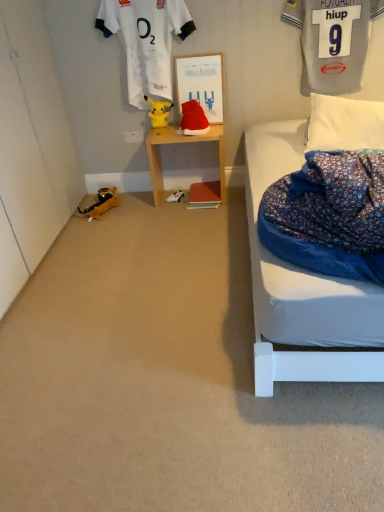
This screenshot has width=384, height=512. What do you see at coordinates (179, 143) in the screenshot?
I see `wooden nightstand at center` at bounding box center [179, 143].

In order to face wooden nightstand at center, should I rotate leftwards or rightwards?

A 0.340 degree turn to the left will do.

The height and width of the screenshot is (512, 384). What do you see at coordinates (201, 83) in the screenshot?
I see `matte cardboard bulletin board at center` at bounding box center [201, 83].

Locate an element on the screen. white jersey at upper left, the second clothing positioned from the right is located at coordinates (146, 41).

Where is `velvet red santa hat at center, the 2th toy in the bottom-to-top sequence`? velvet red santa hat at center, the 2th toy in the bottom-to-top sequence is located at coordinates (193, 119).

Measure the distance between yellow plush toy at center, the 1th toy in the top-to-bottom sequence, and camera.

2.89 meters.

This screenshot has height=512, width=384. Describe the element at coordinates (134, 136) in the screenshot. I see `white plastic power outlet at lower center` at that location.

The width and height of the screenshot is (384, 512). I want to click on white soft pillow at right, so click(344, 124).

How different are the orientations of white jersey at upper left, the second clothing positioned from the right, and white plastic power outlet at lower center in degrees?

There is a 1.16-degree angle between the facing directions of white jersey at upper left, the second clothing positioned from the right, and white plastic power outlet at lower center.

Choose the correct answer: Is white jersey at upper left, the second clothing positioned from the right, inside white plastic power outlet at lower center or outside it?

white jersey at upper left, the second clothing positioned from the right, exists outside the volume of white plastic power outlet at lower center.

Is white jersey at upper left, which is counted as the first clothing, starting from the left, at the right side of white plastic power outlet at lower center?

Correct, you'll find white jersey at upper left, which is counted as the first clothing, starting from the left, to the right of white plastic power outlet at lower center.

Is white jersey at upper left, which is counted as the first clothing, starting from the left, far away from white plastic power outlet at lower center?

Actually, white jersey at upper left, which is counted as the first clothing, starting from the left, and white plastic power outlet at lower center are a little close together.

Would you say velvet red santa hat at center, acting as the 1th toy starting from the right, is outside yellow rubber duck at lower left, the first toy when ordered from left to right?

Absolutely, velvet red santa hat at center, acting as the 1th toy starting from the right, is external to yellow rubber duck at lower left, the first toy when ordered from left to right.

Does point (186, 113) appear closer or farther from the camera than point (82, 210)?

Point (186, 113) is positioned closer to the camera compared to point (82, 210).

Could you tell me if velvet red santa hat at center, marked as the 2th toy in a top-to-bottom arrangement, is facing yellow rubber duck at lower left, which is the 3th toy from right to left?

No, velvet red santa hat at center, marked as the 2th toy in a top-to-bottom arrangement, is not aimed at yellow rubber duck at lower left, which is the 3th toy from right to left.

Is velvet red santa hat at center, the 2th toy in the bottom-to-top sequence, thinner than yellow rubber duck at lower left, positioned as the 1th toy in bottom-to-top order?

Yes, velvet red santa hat at center, the 2th toy in the bottom-to-top sequence, is thinner than yellow rubber duck at lower left, positioned as the 1th toy in bottom-to-top order.

From a real-world perspective, is matte cardboard bulletin board at center positioned over yellow plush toy at center, the 2th toy viewed from the left, based on gravity?

Yes, from a real-world perspective, matte cardboard bulletin board at center is on top of yellow plush toy at center, the 2th toy viewed from the left.

Is matte cardboard bulletin board at center turned away from yellow plush toy at center, the 3th toy when ordered from bottom to top?

No.

From the image's perspective, does matte cardboard bulletin board at center appear higher than yellow plush toy at center, the 1th toy in the top-to-bottom sequence?

Yes, from the image's perspective, matte cardboard bulletin board at center is above yellow plush toy at center, the 1th toy in the top-to-bottom sequence.

From a real-world perspective, which object stands above the other?

yellow rubber duck at lower left, positioned as the 1th toy in bottom-to-top order.

Which object is closer to the camera, yellow rubber duck at lower left, the 3th toy from the top, or white plastic game controller at center?

yellow rubber duck at lower left, the 3th toy from the top, is more forward.

Would you say yellow rubber duck at lower left, which is the 3th toy from right to left, is inside or outside white plastic game controller at center?

yellow rubber duck at lower left, which is the 3th toy from right to left, cannot be found inside white plastic game controller at center.

Based on their sizes in the image, would you say yellow rubber duck at lower left, the 3th toy from the top, is bigger or smaller than white plastic game controller at center?

yellow rubber duck at lower left, the 3th toy from the top, is bigger than white plastic game controller at center.

Is gray jersey at upper right, marked as the second clothing in a left-to-right arrangement, at the back of wooden nightstand at center?

That's not correct — wooden nightstand at center is not looking away from gray jersey at upper right, marked as the second clothing in a left-to-right arrangement.

How far apart are wooden nightstand at center and gray jersey at upper right, marked as the second clothing in a left-to-right arrangement?

The distance of wooden nightstand at center from gray jersey at upper right, marked as the second clothing in a left-to-right arrangement, is 88.14 centimeters.

Is wooden nightstand at center bigger than gray jersey at upper right, which is counted as the first clothing, starting from the right?

Indeed, wooden nightstand at center has a larger size compared to gray jersey at upper right, which is counted as the first clothing, starting from the right.

Is white plastic game controller at center positioned with its back to wooden nightstand at center?

That's right, white plastic game controller at center is facing away from wooden nightstand at center.

From the image's perspective, is white plastic game controller at center above wooden nightstand at center?

No, from the image's perspective, white plastic game controller at center is not above wooden nightstand at center.

Is white plastic game controller at center wider than wooden nightstand at center?

In fact, white plastic game controller at center might be narrower than wooden nightstand at center.

From a real-world perspective, does white jersey at upper left, the second clothing positioned from the right, sit lower than white plastic game controller at center?

Incorrect, from a real-world perspective, white jersey at upper left, the second clothing positioned from the right, is higher than white plastic game controller at center.

Does white jersey at upper left, the second clothing positioned from the right, contain white plastic game controller at center?

That's incorrect, white plastic game controller at center is not inside white jersey at upper left, the second clothing positioned from the right.

Considering the relative sizes of white jersey at upper left, which is counted as the first clothing, starting from the left, and white plastic game controller at center in the image provided, is white jersey at upper left, which is counted as the first clothing, starting from the left, wider than white plastic game controller at center?

No.

Which is nearer, (138, 26) or (172, 201)?

Point (138, 26)

Identify the location of power outlet lying on the left of white jersey at upper left, the second clothing positioned from the right. (134, 136).

The image size is (384, 512). I want to click on the 1st toy above when counting from the yellow rubber duck at lower left, which is the 3th toy from right to left (from the image's perspective), so click(x=193, y=119).

Based on the photo, estimate the real-world distances between objects in this image. Which object is closer to matte cardboard bulletin board at center, white jersey at upper left, the second clothing positioned from the right, or gray jersey at upper right, which is counted as the first clothing, starting from the right?

The object closer to matte cardboard bulletin board at center is white jersey at upper left, the second clothing positioned from the right.

Based on their spatial positions, is yellow rubber duck at lower left, positioned as the 1th toy in bottom-to-top order, or velvet red santa hat at center, marked as the 2th toy in a top-to-bottom arrangement, further from white plastic power outlet at lower center?

Based on the image, velvet red santa hat at center, marked as the 2th toy in a top-to-bottom arrangement, appears to be further to white plastic power outlet at lower center.

Looking at the image, which one is located further to wooden nightstand at center, matte cardboard bulletin board at center or white plastic game controller at center?

Among the two, white plastic game controller at center is located further to wooden nightstand at center.

From the image, which object appears to be farther from velvet red santa hat at center, placed as the third toy when sorted from left to right, white plastic game controller at center or white plastic power outlet at lower center?

white plastic game controller at center.

When comparing their distances from yellow rubber duck at lower left, the first toy when ordered from left to right, does yellow plush toy at center, the 3th toy when ordered from bottom to top, or white jersey at upper left, which is counted as the first clothing, starting from the left, seem further?

white jersey at upper left, which is counted as the first clothing, starting from the left, lies further to yellow rubber duck at lower left, the first toy when ordered from left to right, than the other object.

Which object lies nearer to the anchor point matte cardboard bulletin board at center, yellow rubber duck at lower left, the 3th toy from the top, or velvet red santa hat at center, placed as the third toy when sorted from left to right?

velvet red santa hat at center, placed as the third toy when sorted from left to right.

Based on their spatial positions, is velvet red santa hat at center, the 2th toy in the bottom-to-top sequence, or yellow rubber duck at lower left, the 3th toy from the top, closer to yellow plush toy at center, the 2th toy viewed from the left?

velvet red santa hat at center, the 2th toy in the bottom-to-top sequence, lies closer to yellow plush toy at center, the 2th toy viewed from the left, than the other object.

Considering their positions, is velvet red santa hat at center, the 2th toy in the bottom-to-top sequence, positioned closer to white plastic game controller at center than yellow plush toy at center, positioned as the 2th toy in right-to-left order?

yellow plush toy at center, positioned as the 2th toy in right-to-left order, is positioned closer to the anchor white plastic game controller at center.

Identify the location of bulletin board between velvet red santa hat at center, the 2th toy in the bottom-to-top sequence, and white soft pillow at right, in the horizontal direction. (201, 83).

This screenshot has width=384, height=512. In order to click on bulletin board between white jersey at upper left, which is counted as the first clothing, starting from the left, and white soft pillow at right, in the horizontal direction in this screenshot , I will do pos(201,83).

Where is `power outlet located between yellow rubber duck at lower left, which is the 3th toy from right to left, and gray jersey at upper right, marked as the second clothing in a left-to-right arrangement, in the left-right direction`? This screenshot has height=512, width=384. power outlet located between yellow rubber duck at lower left, which is the 3th toy from right to left, and gray jersey at upper right, marked as the second clothing in a left-to-right arrangement, in the left-right direction is located at coordinates (134, 136).

This screenshot has height=512, width=384. I want to click on nightstand between white plastic power outlet at lower center and gray jersey at upper right, marked as the second clothing in a left-to-right arrangement, from left to right, so click(179, 143).